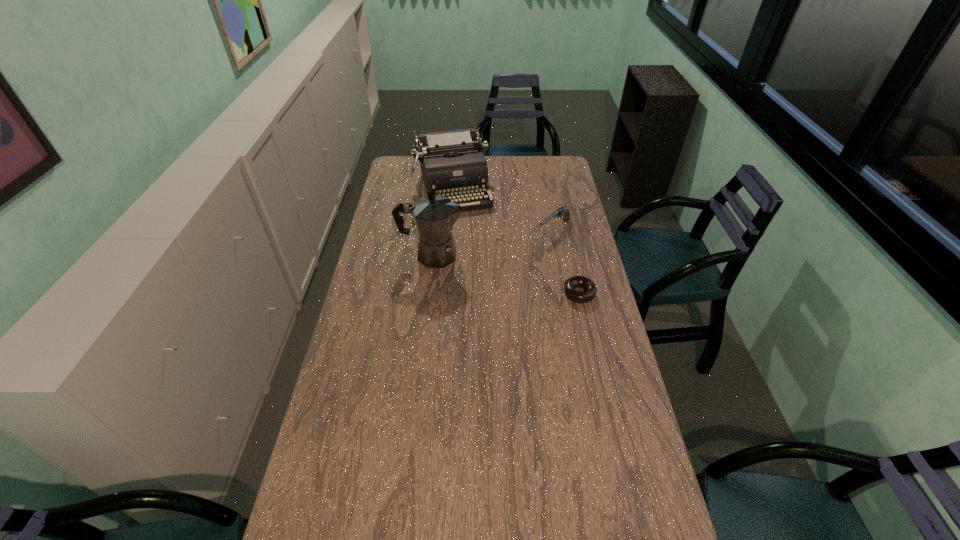
The width and height of the screenshot is (960, 540). Identify the location of free spot on the desktop that is between the coffeepot and the nearest object and is positioned aiming along the barrel of the gun. (497, 272).

Locate an element on the screen. free space on the desktop that is between the second nearest object and the shortest object and is positioned on the front-facing side of the second tallest object is located at coordinates (481, 268).